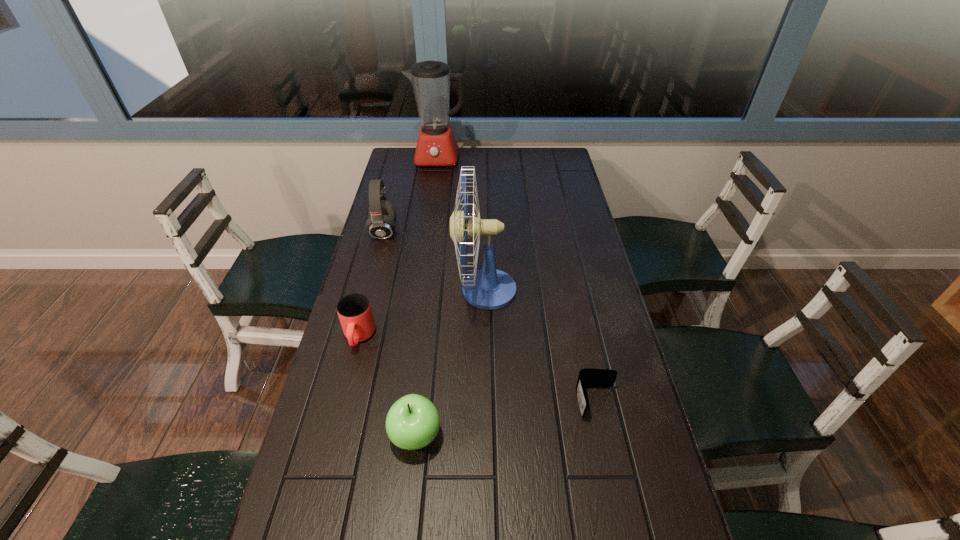
Locate an element on the screen. The height and width of the screenshot is (540, 960). free region located at the front of the fan where the blades are visible is located at coordinates (434, 290).

The image size is (960, 540). What are the coordinates of `vacant area located at the front of the fan where the blades are visible` in the screenshot? It's located at (390, 290).

At what (x,y) coordinates should I click in order to perform the action: click on free space located on the ear cups of the headset. Please return your answer as a coordinate pair (x, y). The image size is (960, 540). Looking at the image, I should click on (483, 231).

You are a GUI agent. You are given a task and a screenshot of the screen. Output one action in this format:
    pyautogui.click(x=<x>, y=<y>)
    Task: Click on the vacant space located 0.120m on the left of the apple
    This screenshot has width=960, height=540.
    Given the screenshot: What is the action you would take?
    point(335,436)

Find the location of a particular element. The height and width of the screenshot is (540, 960). free space located on the handle side of the cup is located at coordinates (349, 375).

The width and height of the screenshot is (960, 540). What are the coordinates of `free region located 0.090m on the outer surface of the wallet` in the screenshot? It's located at (610, 460).

Find the location of a particular element. This screenshot has width=960, height=540. object that is at the far edge is located at coordinates point(436,146).

Find the location of a particular element. blender that is at the left edge is located at coordinates (436, 146).

Identify the location of headset situated at the left edge. This screenshot has height=540, width=960. (381, 223).

You are a GUI agent. You are given a task and a screenshot of the screen. Output one action in this format:
    pyautogui.click(x=<x>, y=<y>)
    Task: Click on the cup present at the left edge
    Image resolution: width=960 pixels, height=540 pixels.
    Given the screenshot: What is the action you would take?
    pyautogui.click(x=355, y=314)